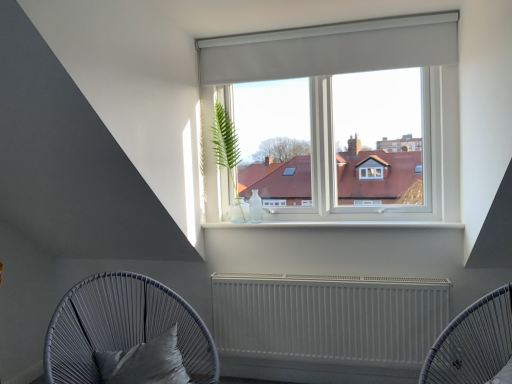
Question: Considering the relative positions of white matte radiator at center and green leafy plant in glass vase at upper left in the image provided, is white matte radiator at center to the left of green leafy plant in glass vase at upper left from the viewer's perspective?

Choices:
 (A) no
 (B) yes

Answer: (A)

Question: Is white matte radiator at center smaller than green leafy plant in glass vase at upper left?

Choices:
 (A) yes
 (B) no

Answer: (B)

Question: Is white matte radiator at center closer to camera compared to green leafy plant in glass vase at upper left?

Choices:
 (A) yes
 (B) no

Answer: (A)

Question: From a real-world perspective, does white matte radiator at center sit lower than green leafy plant in glass vase at upper left?

Choices:
 (A) no
 (B) yes

Answer: (B)

Question: Is white matte radiator at center located outside green leafy plant in glass vase at upper left?

Choices:
 (A) yes
 (B) no

Answer: (A)

Question: Does point (506, 311) appear closer or farther from the camera than point (177, 299)?

Choices:
 (A) closer
 (B) farther

Answer: (A)

Question: Visually, is white matte radiator at lower center, arranged as the 2th furniture when viewed from the left, positioned to the left or to the right of matte grey wicker chair with cushion at lower left, the first furniture from the left?

Choices:
 (A) right
 (B) left

Answer: (A)

Question: Which is correct: white matte radiator at lower center, positioned as the 1th furniture in right-to-left order, is inside matte grey wicker chair with cushion at lower left, acting as the 2th furniture starting from the right, or outside of it?

Choices:
 (A) inside
 (B) outside

Answer: (B)

Question: Is white matte radiator at lower center, positioned as the 1th furniture in right-to-left order, in front of or behind matte grey wicker chair with cushion at lower left, the first furniture from the left, in the image?

Choices:
 (A) front
 (B) behind

Answer: (A)

Question: Considering the positions of white matte radiator at center and white matte radiator at lower center, arranged as the 2th furniture when viewed from the left, in the image, is white matte radiator at center wider or thinner than white matte radiator at lower center, arranged as the 2th furniture when viewed from the left,?

Choices:
 (A) thin
 (B) wide

Answer: (A)

Question: In terms of height, does white matte radiator at center look taller or shorter compared to white matte radiator at lower center, positioned as the 1th furniture in right-to-left order?

Choices:
 (A) short
 (B) tall

Answer: (A)

Question: Considering the positions of white matte radiator at center and white matte radiator at lower center, arranged as the 2th furniture when viewed from the left, in the image, is white matte radiator at center bigger or smaller than white matte radiator at lower center, arranged as the 2th furniture when viewed from the left,?

Choices:
 (A) small
 (B) big

Answer: (A)

Question: Is white matte radiator at center situated inside white matte radiator at lower center, positioned as the 1th furniture in right-to-left order, or outside?

Choices:
 (A) inside
 (B) outside

Answer: (B)

Question: From the image's perspective, is white matte radiator at lower center, positioned as the 1th furniture in right-to-left order, above or below satin black pillow at lower left?

Choices:
 (A) above
 (B) below

Answer: (A)

Question: Do you think white matte radiator at lower center, arranged as the 2th furniture when viewed from the left, is within satin black pillow at lower left, or outside of it?

Choices:
 (A) inside
 (B) outside

Answer: (B)